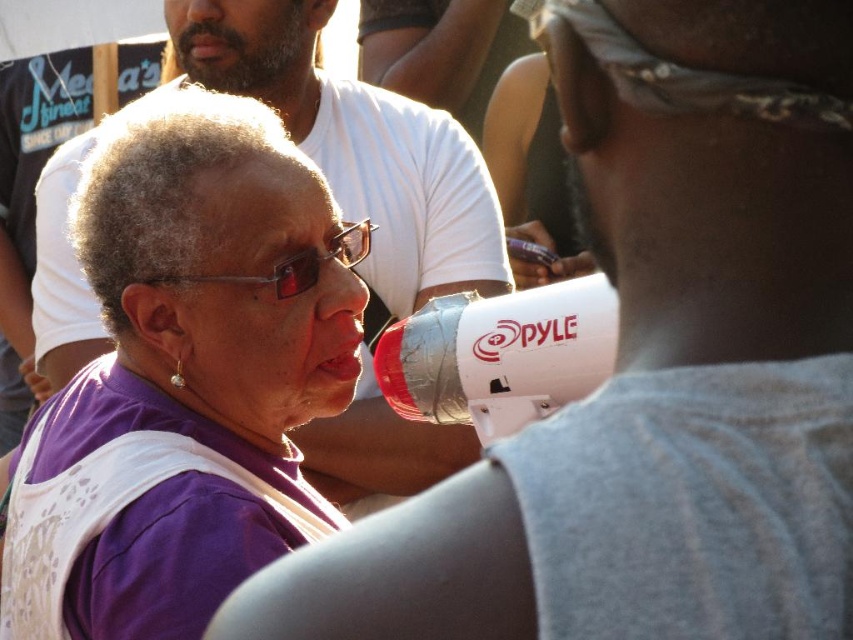
From the picture: You are a photographer at the event and want to take a photo of the bearded man at upper left and the sunglasses at center. Based on their positions, which object should you focus on first to ensure both are in the frame?

The sunglasses at center is below the bearded man at upper left, so you should focus on the bearded man at upper left first to ensure both are in the frame.

What is the exact coordinate of the purple fabric at center?

The purple fabric at center is located at point (184, 376).